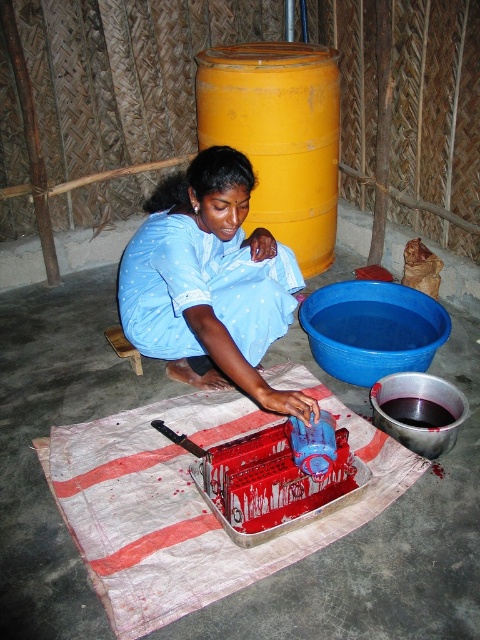
Can you confirm if blue cotton fabric at center is thinner than blue plastic basin at lower center?

Incorrect, blue cotton fabric at center's width is not less than blue plastic basin at lower center's.

How much distance is there between blue cotton fabric at center and blue plastic basin at lower center?

blue cotton fabric at center is 18.56 inches away from blue plastic basin at lower center.

I want to click on blue cotton fabric at center, so 210,282.

Who is positioned more to the right, blue plastic basin at lower center or metallic silver bowl at lower right?

metallic silver bowl at lower right

Who is more forward, (x=359, y=308) or (x=415, y=422)?

Point (x=415, y=422) is more forward.

Describe the element at coordinates (372, 330) in the screenshot. Image resolution: width=480 pixels, height=640 pixels. I see `blue plastic basin at lower center` at that location.

In order to click on blue plastic basin at lower center in this screenshot , I will do coord(372,330).

Where is `blue cotton fabric at center`? blue cotton fabric at center is located at coordinates (210, 282).

Which of these two, blue cotton fabric at center or metallic silver bowl at lower right, stands shorter?

With less height is metallic silver bowl at lower right.

What do you see at coordinates (210, 282) in the screenshot?
I see `blue cotton fabric at center` at bounding box center [210, 282].

Locate an element on the screen. blue cotton fabric at center is located at coordinates (210, 282).